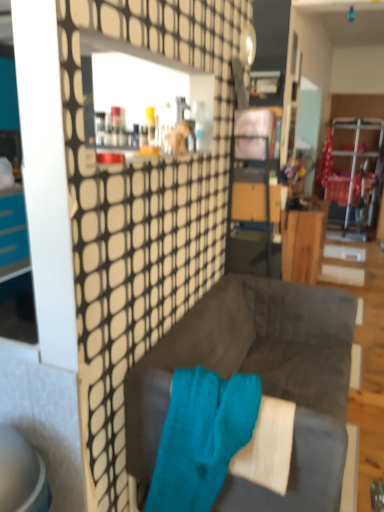
Question: From the image's perspective, is teal soft towel at center above velvet dark gray couch at center?

Choices:
 (A) no
 (B) yes

Answer: (A)

Question: Can you confirm if teal soft towel at center is bigger than velvet dark gray couch at center?

Choices:
 (A) yes
 (B) no

Answer: (B)

Question: Can you confirm if teal soft towel at center is smaller than velvet dark gray couch at center?

Choices:
 (A) yes
 (B) no

Answer: (A)

Question: Would you say teal soft towel at center contains velvet dark gray couch at center?

Choices:
 (A) no
 (B) yes

Answer: (A)

Question: Is teal soft towel at center oriented away from velvet dark gray couch at center?

Choices:
 (A) no
 (B) yes

Answer: (B)

Question: Does teal soft towel at center touch velvet dark gray couch at center?

Choices:
 (A) yes
 (B) no

Answer: (B)

Question: From a real-world perspective, is wooden desk at center on top of velvet dark gray couch at center?

Choices:
 (A) no
 (B) yes

Answer: (B)

Question: Is wooden desk at center to the right of velvet dark gray couch at center from the viewer's perspective?

Choices:
 (A) no
 (B) yes

Answer: (B)

Question: Is the depth of wooden desk at center less than that of velvet dark gray couch at center?

Choices:
 (A) yes
 (B) no

Answer: (B)

Question: Can you confirm if wooden desk at center is smaller than velvet dark gray couch at center?

Choices:
 (A) no
 (B) yes

Answer: (B)

Question: Can you confirm if wooden desk at center is shorter than velvet dark gray couch at center?

Choices:
 (A) no
 (B) yes

Answer: (A)

Question: From a real-world perspective, does wooden desk at center sit lower than velvet dark gray couch at center?

Choices:
 (A) no
 (B) yes

Answer: (A)

Question: Is the position of wooden desk at center more distant than that of teal soft towel at center?

Choices:
 (A) yes
 (B) no

Answer: (A)